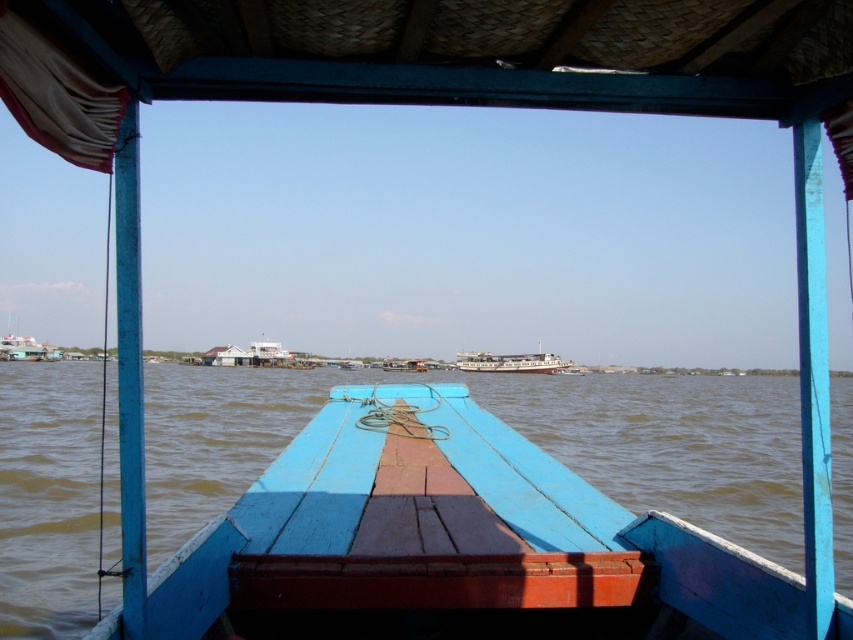
You are a sailor on the boat and you notice the brown water at center and the white glossy ship at center. Which one is positioned higher from your viewpoint?

The brown water at center is positioned higher than the white glossy ship at center from your viewpoint.

You are navigating a small boat and need to avoid the brown water at center. Based on the coordinates provided, in which direction should you steer your boat to stay clear of the brown water?

The brown water at center is located at coordinates point (672, 444). To avoid it, steer your boat away from that central area towards the edges of the water body.